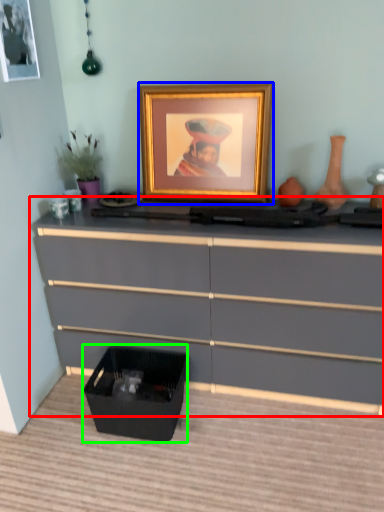
Question: Which object is the farthest from chest of drawers (highlighted by a red box)? Choose among these: picture frame (highlighted by a blue box) or storage box (highlighted by a green box).

Choices:
 (A) picture frame
 (B) storage box

Answer: (A)